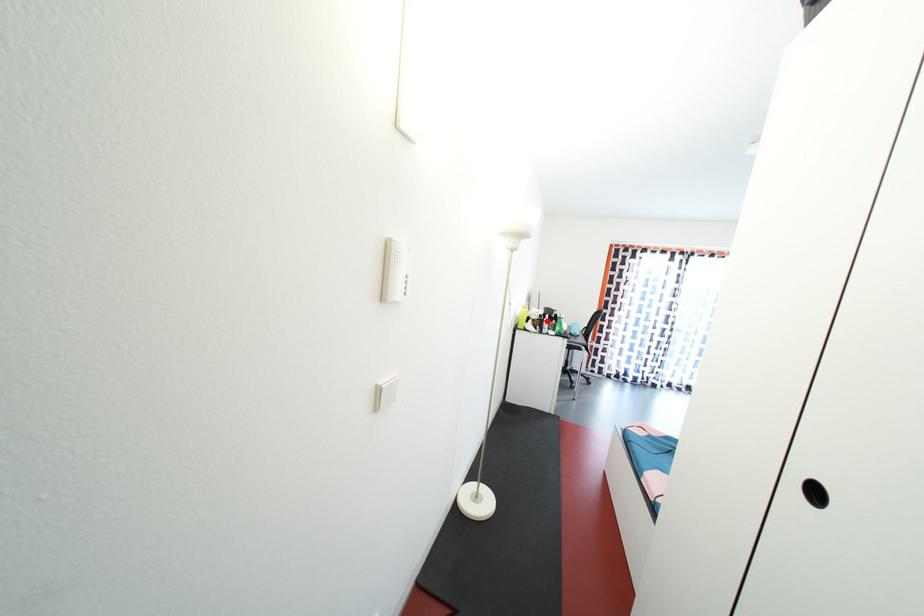
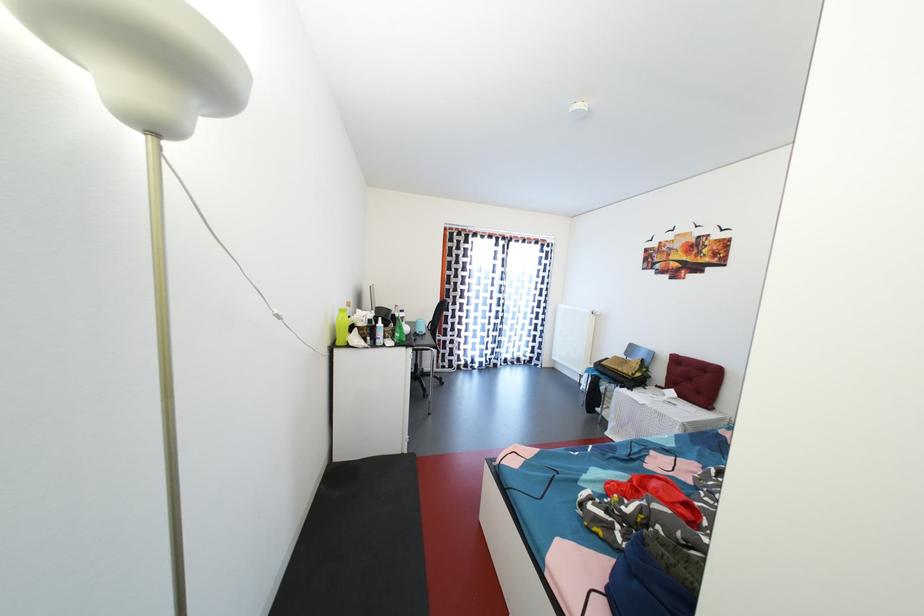
Where in the second image is the point corresponding to the highlighted location from the first image?

(377, 326)